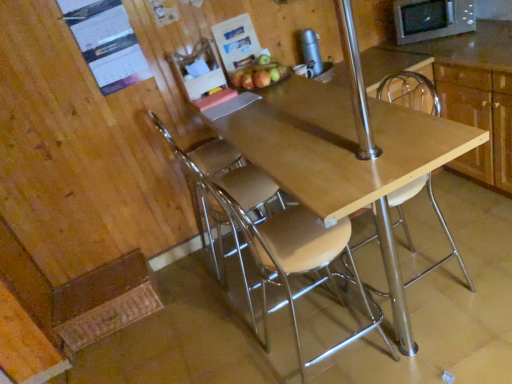
Locate an element on the screen. The height and width of the screenshot is (384, 512). vacant region to the left of metallic silver chair at center, the first chair when ordered from left to right is located at coordinates tap(190, 279).